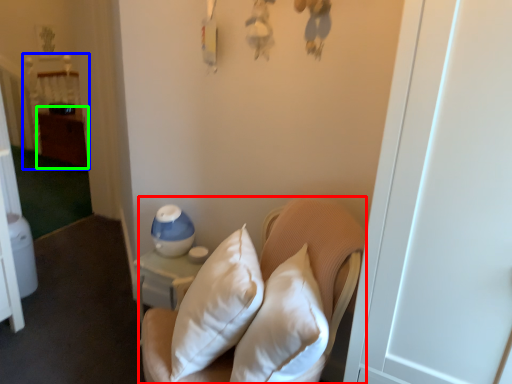
Question: Based on their relative distances, which object is farther from furniture (highlighted by a red box)? Choose from bed (highlighted by a blue box) and dresser (highlighted by a green box).

Choices:
 (A) bed
 (B) dresser

Answer: (A)